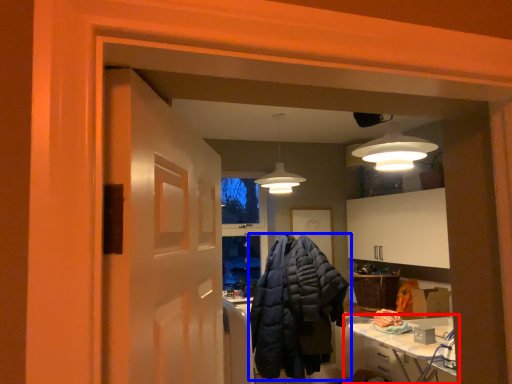
Question: Which object appears closest to the camera in this image, table (highlighted by a red box) or jacket (highlighted by a blue box)?

Choices:
 (A) table
 (B) jacket

Answer: (A)